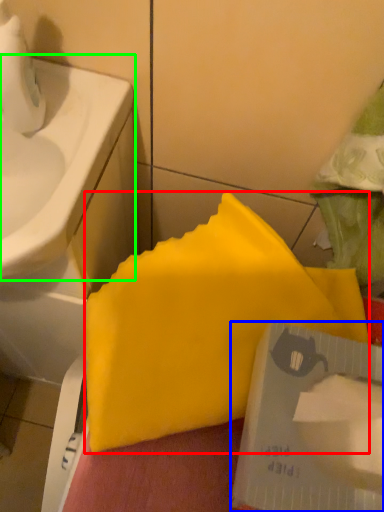
Question: Which object is the farthest from waste (highlighted by a red box)? Choose among these: writing (highlighted by a blue box) or sink (highlighted by a green box).

Choices:
 (A) writing
 (B) sink

Answer: (B)